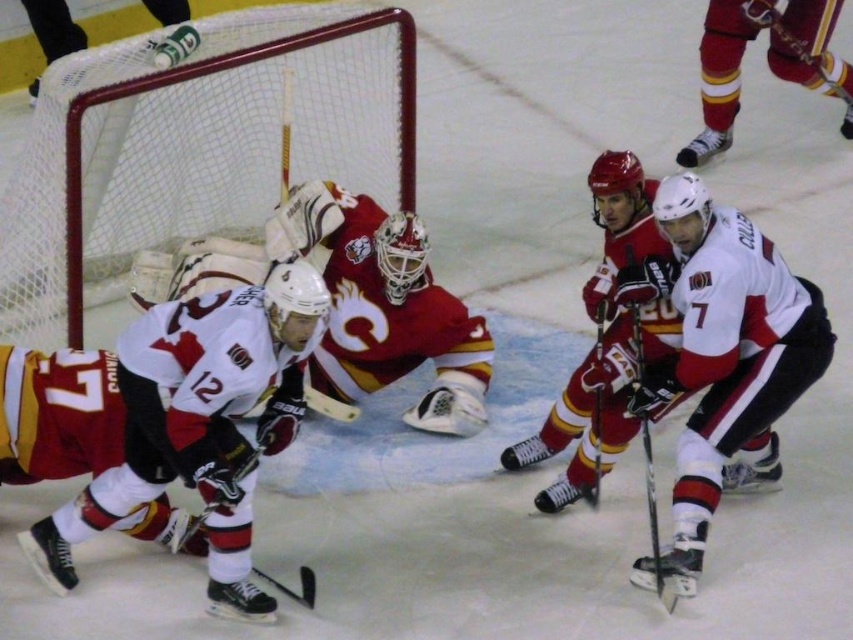
Describe the element at coordinates (381, 312) in the screenshot. I see `matte red goalie at center` at that location.

Measure the distance between point (422,237) and camera.

16.07 feet

Who is more forward, [297,227] or [659,346]?

Point [659,346]

At what (x,y) coordinates should I click in order to perform the action: click on matte red goalie at center. Please return your answer as a coordinate pair (x, y). The image size is (853, 640). Looking at the image, I should click on (381, 312).

Who is more forward, (688, 378) or (585, 499)?

Point (688, 378)

Who is positioned more to the left, white matte hockey stick at center or shiny black hockey stick at center?

Positioned to the left is shiny black hockey stick at center.

Where is `white matte hockey stick at center`? This screenshot has height=640, width=853. white matte hockey stick at center is located at coordinates (x=723, y=360).

Find the location of a particular element. white matte hockey stick at center is located at coordinates (723, 360).

Is point (144, 374) positioned behind point (814, 323)?

No.

Does white matte jersey at center have a larger size compared to white matte hockey stick at center?

Correct, white matte jersey at center is larger in size than white matte hockey stick at center.

Which is behind, point (233, 506) or point (724, 323)?

Point (724, 323)

This screenshot has height=640, width=853. Identify the location of white matte jersey at center. point(200,422).